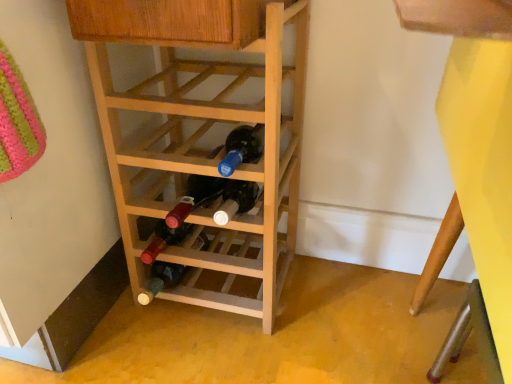
Question: Should I look upward or downward to see yellow matte bunk bed at lower right?

Choices:
 (A) up
 (B) down

Answer: (B)

Question: From a real-world perspective, is natural wood wine rack at center over yellow matte bunk bed at lower right?

Choices:
 (A) yes
 (B) no

Answer: (B)

Question: Is natural wood wine rack at center at the right side of yellow matte bunk bed at lower right?

Choices:
 (A) no
 (B) yes

Answer: (A)

Question: Is natural wood wine rack at center next to yellow matte bunk bed at lower right?

Choices:
 (A) yes
 (B) no

Answer: (B)

Question: Is natural wood wine rack at center bigger than yellow matte bunk bed at lower right?

Choices:
 (A) yes
 (B) no

Answer: (B)

Question: Is natural wood wine rack at center taller than yellow matte bunk bed at lower right?

Choices:
 (A) yes
 (B) no

Answer: (B)

Question: Is natural wood wine rack at center behind yellow matte bunk bed at lower right?

Choices:
 (A) no
 (B) yes

Answer: (B)

Question: From the image's perspective, is yellow matte bunk bed at lower right beneath natural wood wine rack at center?

Choices:
 (A) yes
 (B) no

Answer: (A)

Question: Is yellow matte bunk bed at lower right aimed at natural wood wine rack at center?

Choices:
 (A) no
 (B) yes

Answer: (B)

Question: Is yellow matte bunk bed at lower right shorter than natural wood wine rack at center?

Choices:
 (A) no
 (B) yes

Answer: (A)

Question: Considering the relative positions of yellow matte bunk bed at lower right and natural wood wine rack at center in the image provided, is yellow matte bunk bed at lower right to the left of natural wood wine rack at center from the viewer's perspective?

Choices:
 (A) no
 (B) yes

Answer: (A)

Question: From the image's perspective, is yellow matte bunk bed at lower right over natural wood wine rack at center?

Choices:
 (A) no
 (B) yes

Answer: (A)

Question: Is yellow matte bunk bed at lower right located outside natural wood wine rack at center?

Choices:
 (A) yes
 (B) no

Answer: (A)

Question: Looking at their shapes, would you say yellow matte bunk bed at lower right is wider or thinner than natural wood wine rack at center?

Choices:
 (A) thin
 (B) wide

Answer: (A)